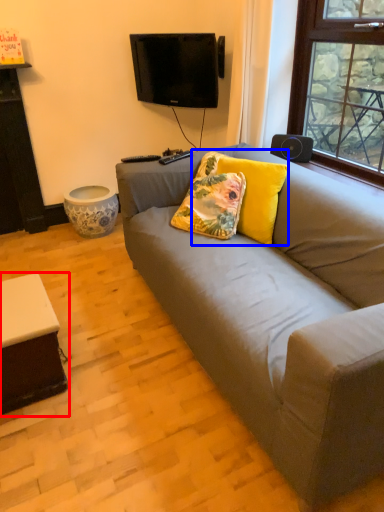
Question: Which point is further to the camera, table (highlighted by a red box) or pillow (highlighted by a blue box)?

Choices:
 (A) table
 (B) pillow

Answer: (B)